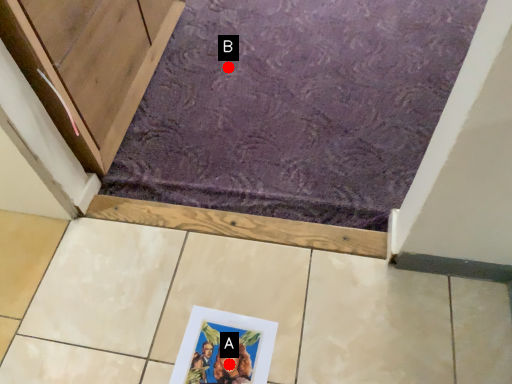
Question: Two points are circled on the image, labeled by A and B beside each circle. Which of the following is the closest to the observer?

Choices:
 (A) A is closer
 (B) B is closer

Answer: (A)